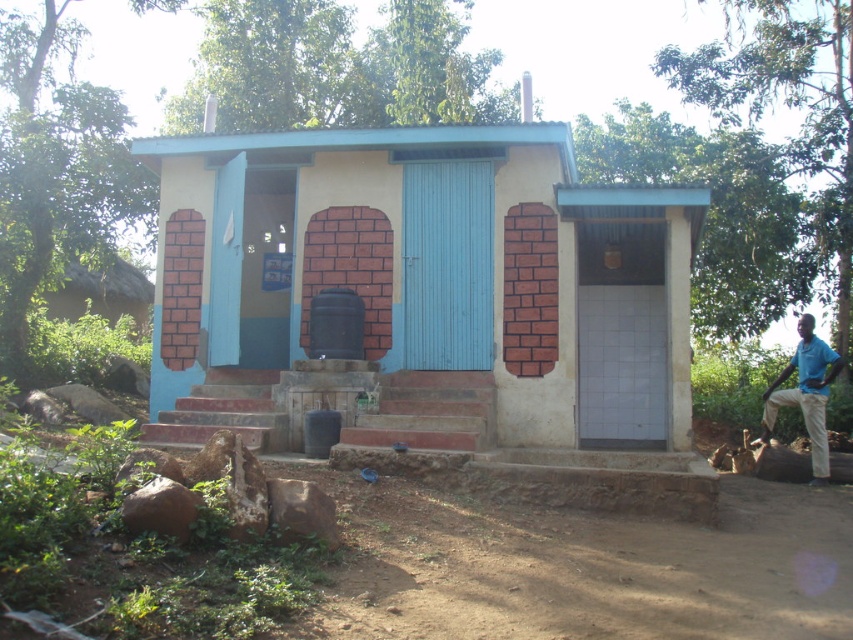
Does matte blue door at center appear over blue shirt at right?

Actually, matte blue door at center is below blue shirt at right.

Does matte blue door at center have a smaller size compared to blue shirt at right?

Correct, matte blue door at center occupies less space than blue shirt at right.

At what (x,y) coordinates should I click in order to perform the action: click on matte blue door at center. Please return your answer as a coordinate pair (x, y). Looking at the image, I should click on (433, 307).